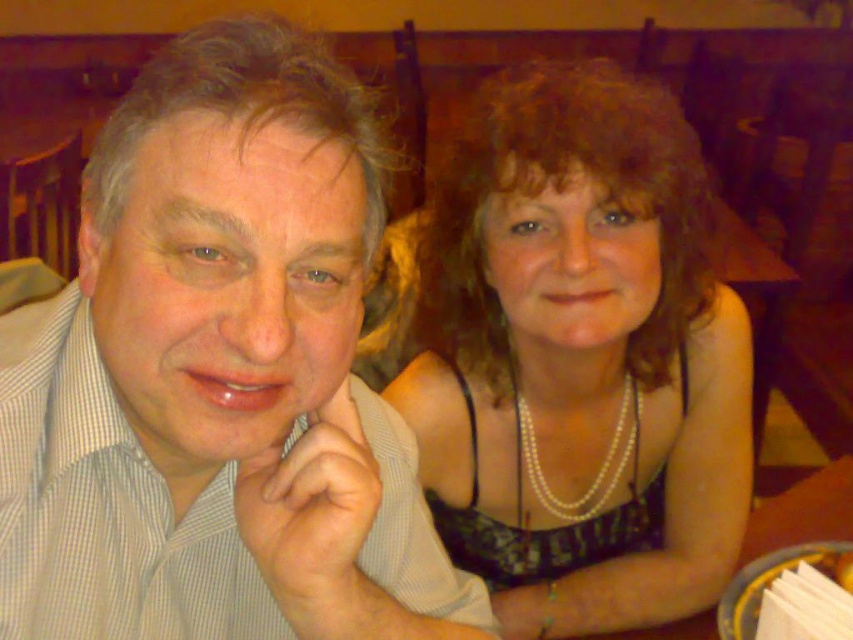
Question: Is pearl necklace at center thinner than yellow glossy plate at lower right?

Choices:
 (A) no
 (B) yes

Answer: (A)

Question: Among these objects, which one is farthest from the camera?

Choices:
 (A) white checkered shirt at left
 (B) yellow glossy plate at lower right

Answer: (B)

Question: Does white checkered shirt at left have a lesser width compared to pearl necklace at center?

Choices:
 (A) yes
 (B) no

Answer: (A)

Question: Estimate the real-world distances between objects in this image. Which object is closer to the pearl necklace at center?

Choices:
 (A) white checkered shirt at left
 (B) yellow glossy plate at lower right

Answer: (B)

Question: Is white checkered shirt at left positioned behind pearl necklace at center?

Choices:
 (A) no
 (B) yes

Answer: (A)

Question: Which point is farther to the camera?

Choices:
 (A) (238, 310)
 (B) (828, 472)

Answer: (B)